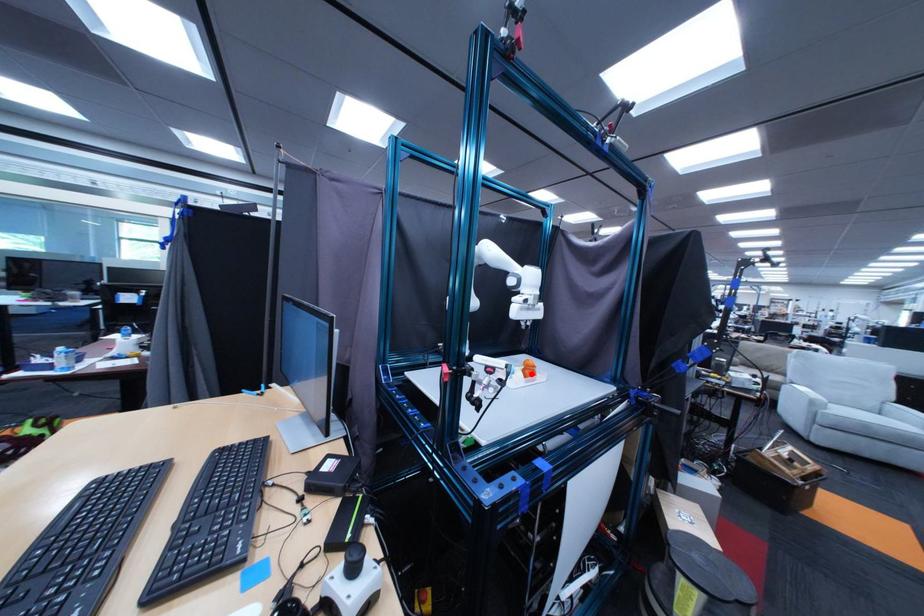
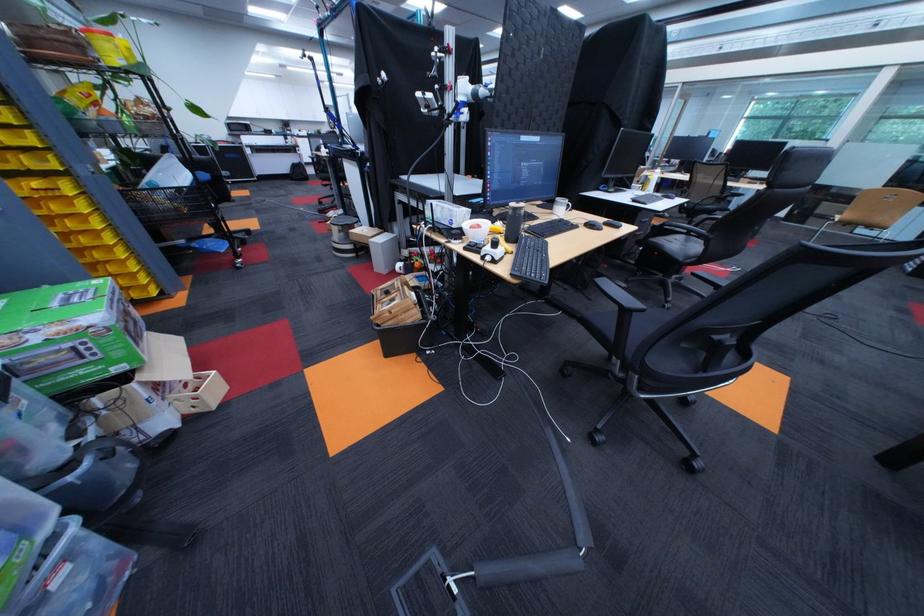
Question: I am providing you with two images of the same scene from different viewpoints. A red point is marked on the first image. Can you still see the location of the red point in image 2?

Choices:
 (A) Yes
 (B) No

Answer: (B)